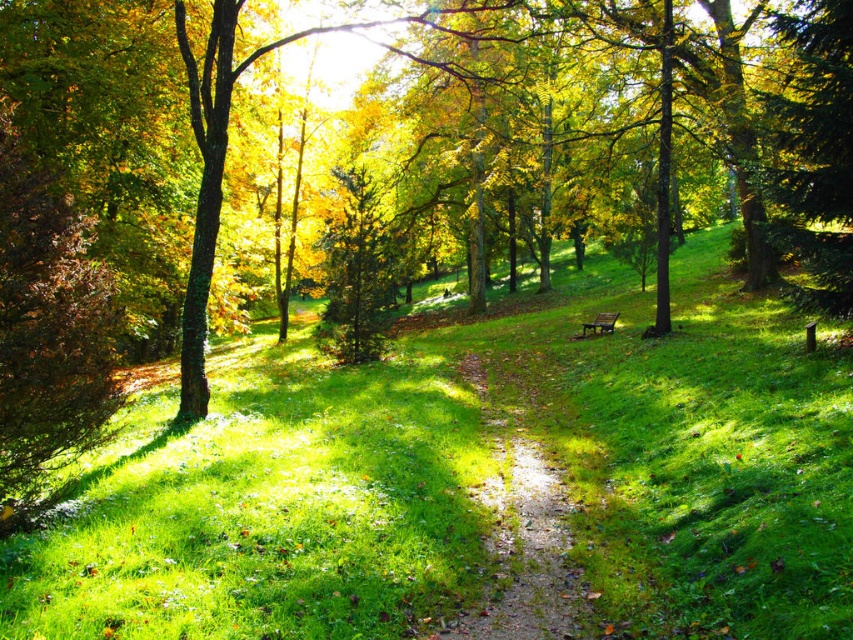
You are a hiker who wants to walk along the path without stepping on the green grassy at center. Based on the scene, which side of the dirt path at center should you walk on?

The green grassy at center is positioned on the left side of dirt path at center, so to avoid stepping on it, you should walk on the right side of the dirt path at center.

Based on the photo, you are a hiker walking along the dirt path at center in the autumn scene. You want to sit down on the wooden park bench at center. In which direction should you turn to face the bench?

The dirt path at center is to the left of wooden park bench at center, so you should turn to your right to face the bench.